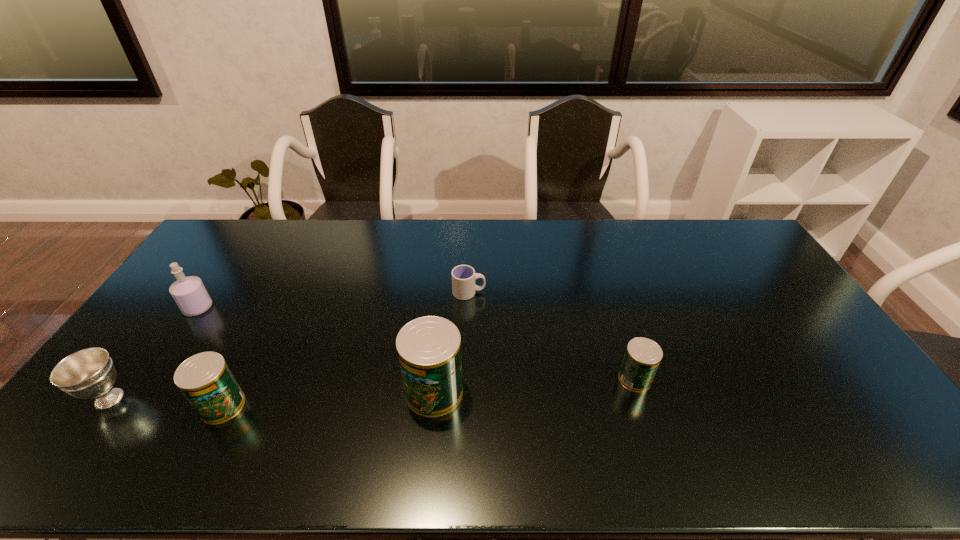
Find the location of a particular element. This screenshot has height=540, width=960. vacant point located on the back of the rightmost can is located at coordinates pyautogui.click(x=612, y=306).

Find the location of a particular element. This screenshot has height=540, width=960. free location located on the back of the fifth shortest object is located at coordinates (218, 279).

The width and height of the screenshot is (960, 540). I want to click on free space located with the handle on the side of the shortest object, so click(x=542, y=293).

In order to click on free space located 0.140m on the right of the chalice in this screenshot , I will do `click(185, 399)`.

Locate an element on the screen. Image resolution: width=960 pixels, height=540 pixels. chalice located at the near edge is located at coordinates (89, 373).

Identify the location of perfume present at the left edge. (x=189, y=293).

Identify the location of chalice located in the left edge section of the desktop. (89, 373).

Find the location of `object positioned at the near left corner`. object positioned at the near left corner is located at coordinates point(89,373).

What are the coordinates of `free location at the far edge` in the screenshot? It's located at (275, 232).

At what (x,y) coordinates should I click in order to perform the action: click on vacant space at the near edge of the desktop. Please return your answer as a coordinate pair (x, y). Looking at the image, I should click on (369, 417).